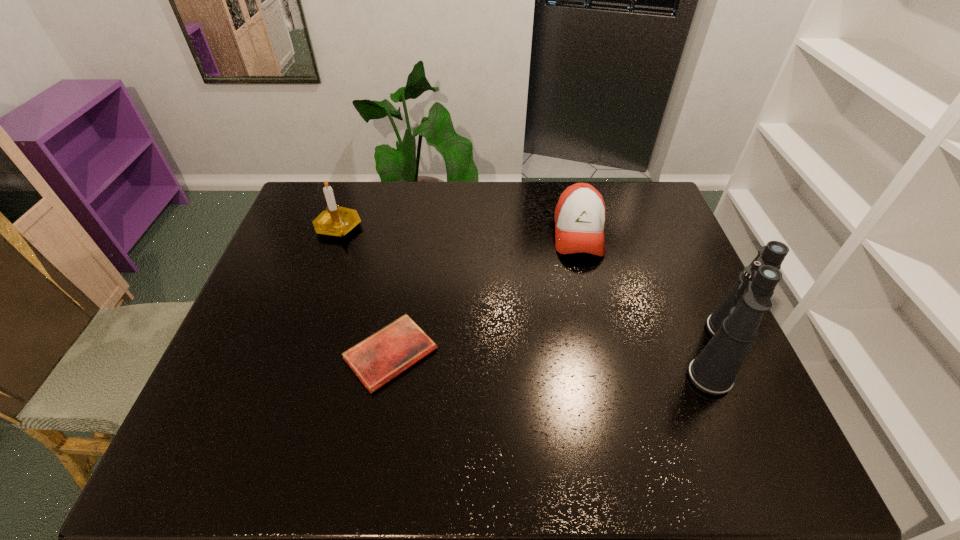
At what (x,y) coordinates should I click in order to perform the action: click on free space between the shortest object and the third shortest object. Please return your answer as a coordinate pair (x, y). This screenshot has width=960, height=540. Looking at the image, I should click on (364, 291).

Where is `free point between the third tallest object and the leftmost object`? The width and height of the screenshot is (960, 540). free point between the third tallest object and the leftmost object is located at coordinates (458, 231).

Locate an element on the screen. empty location between the third object from right to left and the leftmost object is located at coordinates (364, 291).

The height and width of the screenshot is (540, 960). I want to click on free spot between the candle holder and the diary, so click(x=364, y=291).

At what (x,y) coordinates should I click in order to perform the action: click on free point between the second tallest object and the diary. Please return your answer as a coordinate pair (x, y). The image size is (960, 540). Looking at the image, I should click on (364, 291).

This screenshot has height=540, width=960. I want to click on free area in between the baseball cap and the shortest object, so click(x=485, y=294).

Find the location of a particular element. empty space between the shortest object and the rightmost object is located at coordinates (554, 353).

Identify the location of free space between the leftmost object and the rightmost object. This screenshot has width=960, height=540. (528, 290).

Locate an element on the screen. Image resolution: width=960 pixels, height=540 pixels. unoccupied area between the second object from left to right and the binoculars is located at coordinates (554, 353).

Where is `object that is the third closest one to the shortest object`? The width and height of the screenshot is (960, 540). object that is the third closest one to the shortest object is located at coordinates (733, 326).